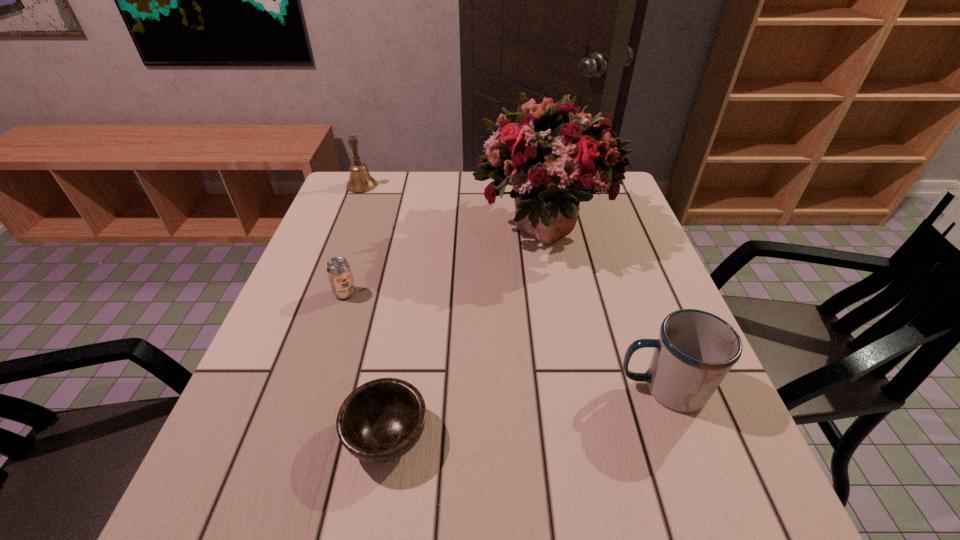
The height and width of the screenshot is (540, 960). I want to click on mug that is positioned at the right edge, so click(x=695, y=350).

This screenshot has width=960, height=540. I want to click on object situated at the far left corner, so click(360, 181).

Find the location of a particular element. Image resolution: width=960 pixels, height=540 pixels. object at the far right corner is located at coordinates (553, 156).

This screenshot has height=540, width=960. Find the location of `vacant region at the far edge of the desktop`. vacant region at the far edge of the desktop is located at coordinates (422, 173).

The height and width of the screenshot is (540, 960). In order to click on free location at the left edge of the desktop in this screenshot , I will do `click(294, 324)`.

What are the coordinates of `blank space at the far left corner of the desktop` in the screenshot? It's located at (358, 194).

Find the location of a particular element. This screenshot has width=960, height=540. vacant space at the far right corner of the desktop is located at coordinates (622, 204).

I want to click on free region at the near right corner, so click(x=686, y=503).

I want to click on free space between the mug and the bell, so click(513, 286).

Image resolution: width=960 pixels, height=540 pixels. Identify the location of free area in between the bell and the third nearest object. (353, 239).